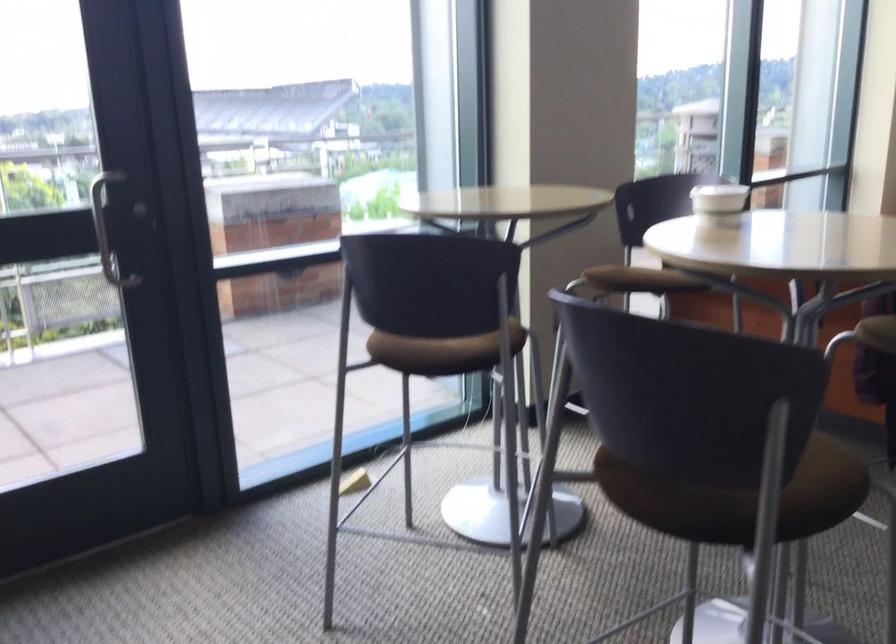
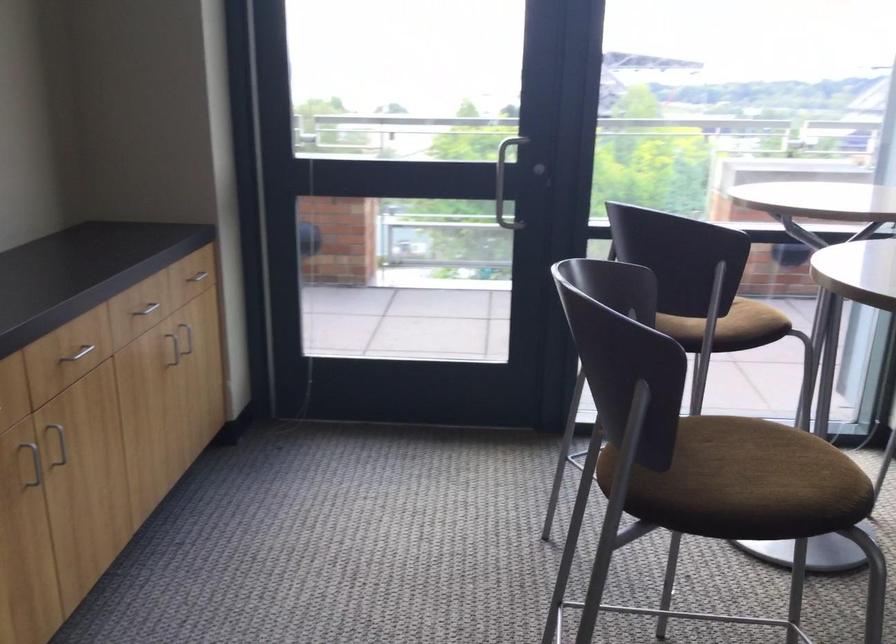
Find the pixel in the second image that matches (x=130, y=216) in the first image.

(503, 173)